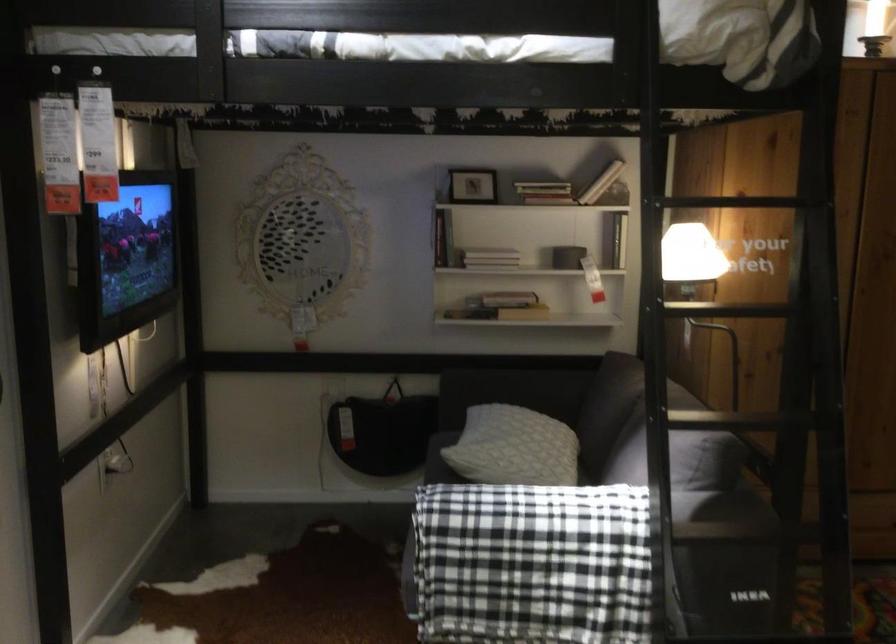
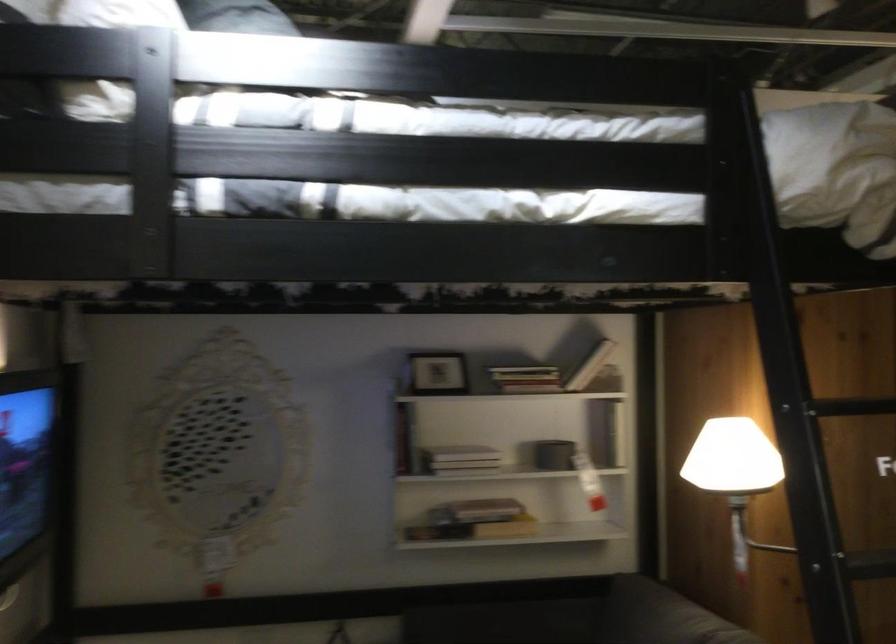
Where in the second image is the point corresponding to (494,245) from the first image?

(460, 453)